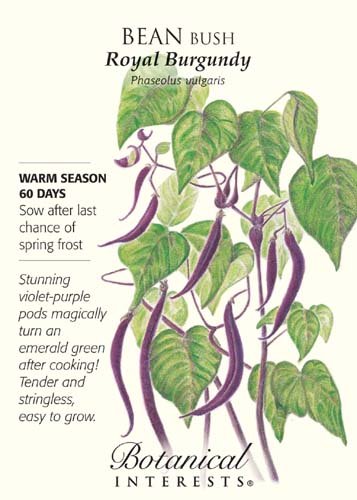
I want to click on colored pictures, so click(287, 388).